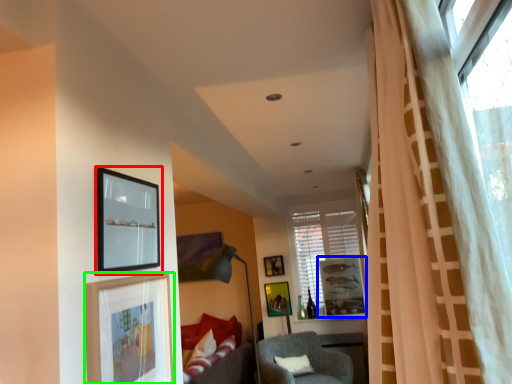
Question: Considering the real-world distances, which object is closest to picture frame (highlighted by a red box)? picture frame (highlighted by a blue box) or picture frame (highlighted by a green box).

Choices:
 (A) picture frame
 (B) picture frame

Answer: (B)